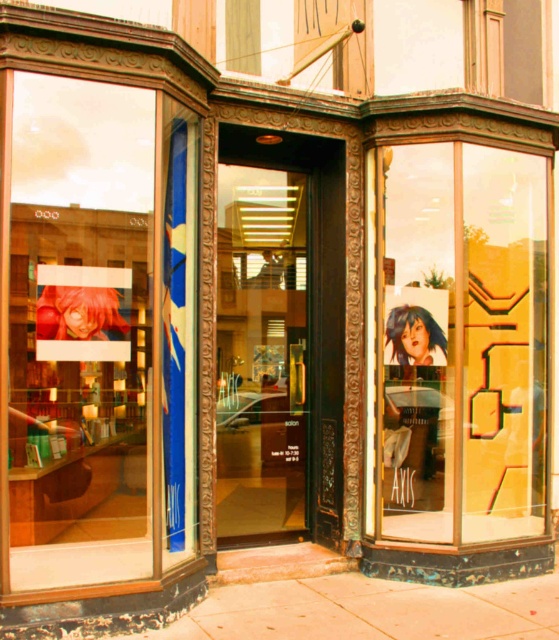
Between matte glass window at left and smooth red hair at left, which one appears on the right side from the viewer's perspective?

Positioned to the right is matte glass window at left.

Is matte glass window at left smaller than smooth red hair at left?

No, matte glass window at left is not smaller than smooth red hair at left.

Who is more distant from viewer, (x=46, y=433) or (x=72, y=298)?

The point (x=46, y=433) is behind.

You are a GUI agent. You are given a task and a screenshot of the screen. Output one action in this format:
    pyautogui.click(x=<x>, y=<y>)
    Task: Click on the matte glass window at left
    Image resolution: width=559 pixels, height=640 pixels.
    Given the screenshot: What is the action you would take?
    pyautogui.click(x=92, y=340)

Does transparent glass door at right have a lesser height compared to smooth red hair at left?

No, transparent glass door at right is not shorter than smooth red hair at left.

Measure the distance between transparent glass door at right and camera.

transparent glass door at right and camera are 5.17 meters apart from each other.

Where is `transparent glass door at right`? The image size is (559, 640). transparent glass door at right is located at coordinates (459, 342).

Is smooth red hair at left to the right of smooth blue hair at upper right from the viewer's perspective?

No, smooth red hair at left is not to the right of smooth blue hair at upper right.

Can you confirm if smooth red hair at left is shorter than smooth blue hair at upper right?

Yes, smooth red hair at left is shorter than smooth blue hair at upper right.

Is point (56, 305) positioned after point (428, 346)?

No, it is in front of (428, 346).

This screenshot has height=640, width=559. In order to click on smooth red hair at left in this screenshot , I will do `click(79, 314)`.